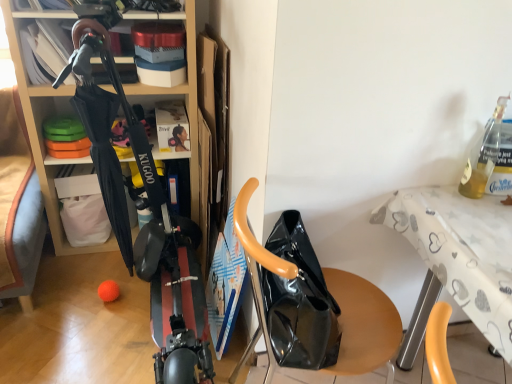
Question: From the image's perspective, is translucent glass bottle at upper right located above glossy black bag at center?

Choices:
 (A) yes
 (B) no

Answer: (A)

Question: Is translucent glass bottle at upper right to the left of glossy black bag at center from the viewer's perspective?

Choices:
 (A) no
 (B) yes

Answer: (A)

Question: Is glossy black bag at center a part of translucent glass bottle at upper right?

Choices:
 (A) yes
 (B) no

Answer: (B)

Question: Does translucent glass bottle at upper right lie behind glossy black bag at center?

Choices:
 (A) no
 (B) yes

Answer: (B)

Question: From a real-world perspective, is translucent glass bottle at upper right positioned under glossy black bag at center based on gravity?

Choices:
 (A) yes
 (B) no

Answer: (B)

Question: Is translucent glass bottle at upper right looking in the opposite direction of glossy black bag at center?

Choices:
 (A) yes
 (B) no

Answer: (B)

Question: From the image's perspective, does translucent glass bottle at upper right appear higher than white printed fabric table at upper right?

Choices:
 (A) yes
 (B) no

Answer: (A)

Question: Is translucent glass bottle at upper right outside of white printed fabric table at upper right?

Choices:
 (A) yes
 (B) no

Answer: (A)

Question: Is white printed fabric table at upper right completely or partially inside translucent glass bottle at upper right?

Choices:
 (A) yes
 (B) no

Answer: (B)

Question: Is translucent glass bottle at upper right facing away from white printed fabric table at upper right?

Choices:
 (A) no
 (B) yes

Answer: (A)

Question: From a real-world perspective, does translucent glass bottle at upper right stand above white printed fabric table at upper right?

Choices:
 (A) yes
 (B) no

Answer: (A)

Question: Is the depth of translucent glass bottle at upper right less than that of white printed fabric table at upper right?

Choices:
 (A) yes
 (B) no

Answer: (B)

Question: Considering the relative sizes of glossy black bag at center and black glossy scooter at center in the image provided, is glossy black bag at center wider than black glossy scooter at center?

Choices:
 (A) yes
 (B) no

Answer: (A)